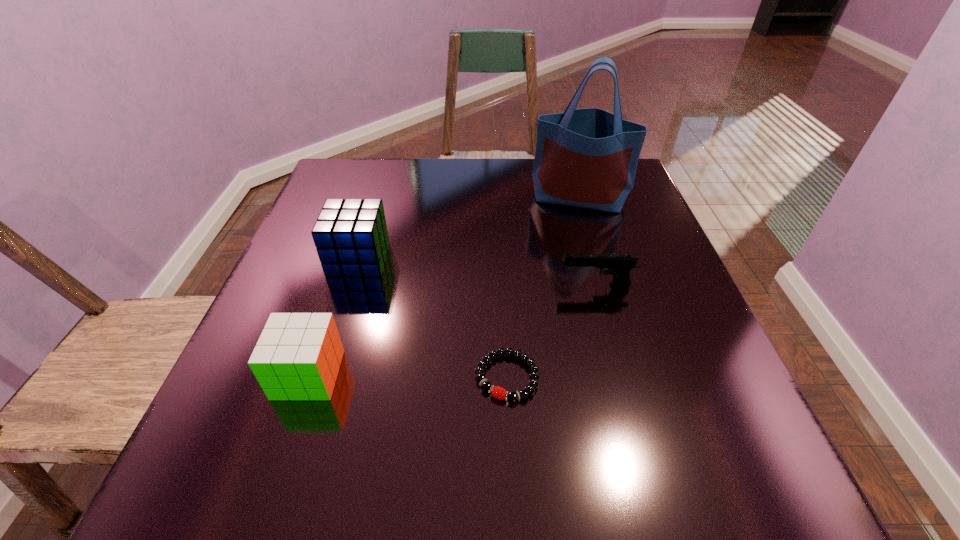
Locate an element on the screen. The width and height of the screenshot is (960, 540). vacant region at the far edge is located at coordinates (496, 199).

Image resolution: width=960 pixels, height=540 pixels. Identify the location of blank area at the left edge. (235, 395).

Where is `free region at the right edge of the desktop`? The image size is (960, 540). free region at the right edge of the desktop is located at coordinates (665, 365).

At what (x,y) coordinates should I click in order to perform the action: click on vacant area at the far left corner of the desktop. Please return your answer as a coordinate pair (x, y). This screenshot has height=540, width=960. Looking at the image, I should click on (384, 174).

Identify the location of vacant region at the near left corner of the desktop. (283, 465).

Identify the location of vacant space at the near right corner of the desktop. (747, 451).

This screenshot has height=540, width=960. I want to click on empty space that is in between the farthest object and the pistol, so 588,242.

Image resolution: width=960 pixels, height=540 pixels. What are the coordinates of `free area in between the handbag and the third object from left to right` in the screenshot? It's located at (543, 287).

Identify the location of free space that is in between the bracelet and the farther cube. This screenshot has width=960, height=540. (433, 318).

Locate an element on the screen. The image size is (960, 540). free space between the pistol and the taller cube is located at coordinates (477, 272).